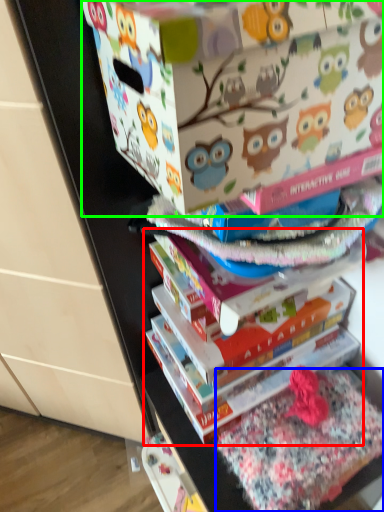
Question: Estimate the real-world distances between objects in this image. Which object is farther from book (highlighted by a red box), fabric (highlighted by a blue box) or cardboard box (highlighted by a green box)?

Choices:
 (A) fabric
 (B) cardboard box

Answer: (B)